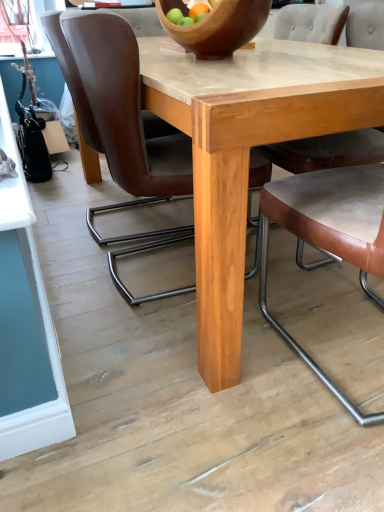
The width and height of the screenshot is (384, 512). What do you see at coordinates (248, 152) in the screenshot?
I see `natural wood table at center` at bounding box center [248, 152].

Where is `brown leather chair at center, acting as the 2th chair starting from the left`? Image resolution: width=384 pixels, height=512 pixels. brown leather chair at center, acting as the 2th chair starting from the left is located at coordinates (116, 98).

Looking at this image, how much space does brown leather chair at center, which ranks as the fourth chair in right-to-left order, occupy horizontally?

The width of brown leather chair at center, which ranks as the fourth chair in right-to-left order, is 24.62 inches.

I want to click on brown leather chair at center, arranged as the third chair when viewed from the left, so click(x=329, y=231).

Which object is positioned more to the right, brown leather chair at center, acting as the 2th chair starting from the left, or brown leather chair at center, which is counted as the second chair, starting from the right?

From the viewer's perspective, brown leather chair at center, which is counted as the second chair, starting from the right, appears more on the right side.

Is brown leather chair at center, which is counted as the second chair, starting from the right, at the back of brown leather chair at center, acting as the 2th chair starting from the left?

No, brown leather chair at center, acting as the 2th chair starting from the left,'s orientation is not away from brown leather chair at center, which is counted as the second chair, starting from the right.

Is the depth of brown leather chair at center, the third chair viewed from the right, greater than that of brown leather chair at center, which is counted as the second chair, starting from the right?

Yes, brown leather chair at center, the third chair viewed from the right, is further from the camera.

From the image's perspective, which is below, brown leather chair at center, the third chair viewed from the right, or brown leather chair at center, arranged as the third chair when viewed from the left?

brown leather chair at center, arranged as the third chair when viewed from the left.

From the image's perspective, which one is positioned lower, natural wood table at center or wooden bowl at center?

natural wood table at center, from the image's perspective.

The image size is (384, 512). Identify the location of round table below the wooden bowl at center (from a real-world perspective). (248, 152).

Does natural wood table at center have a lesser width compared to wooden bowl at center?

In fact, natural wood table at center might be wider than wooden bowl at center.

From the picture: From a real-world perspective, is natural wood table at center under wooden bowl at center?

Yes, from a real-world perspective, natural wood table at center is below wooden bowl at center.

In terms of height, does brown leather chair at center, marked as the 4th chair in a left-to-right arrangement, look taller or shorter compared to wooden bowl at center?

Clearly, brown leather chair at center, marked as the 4th chair in a left-to-right arrangement, is taller compared to wooden bowl at center.

Does brown leather chair at center, acting as the 1th chair starting from the right, turn towards wooden bowl at center?

Yes, brown leather chair at center, acting as the 1th chair starting from the right, faces towards wooden bowl at center.

Visually, is brown leather chair at center, acting as the 1th chair starting from the right, positioned to the left or to the right of brown leather chair at center, the 1th chair in the left-to-right sequence?

brown leather chair at center, acting as the 1th chair starting from the right, is positioned on brown leather chair at center, the 1th chair in the left-to-right sequence,'s right side.

Is brown leather chair at center, acting as the 1th chair starting from the right, directly adjacent to brown leather chair at center, the 1th chair in the left-to-right sequence?

There is a gap between brown leather chair at center, acting as the 1th chair starting from the right, and brown leather chair at center, the 1th chair in the left-to-right sequence.

Which of these two, brown leather chair at center, marked as the 4th chair in a left-to-right arrangement, or brown leather chair at center, the 1th chair in the left-to-right sequence, stands shorter?

With less height is brown leather chair at center, the 1th chair in the left-to-right sequence.

From the image's perspective, would you say brown leather chair at center, marked as the 4th chair in a left-to-right arrangement, is shown under brown leather chair at center, which ranks as the fourth chair in right-to-left order?

Correct, brown leather chair at center, marked as the 4th chair in a left-to-right arrangement, appears lower than brown leather chair at center, which ranks as the fourth chair in right-to-left order, in the image.

From the image's perspective, which one is positioned lower, brown leather chair at center, the 1th chair in the left-to-right sequence, or wooden bowl at center?

brown leather chair at center, the 1th chair in the left-to-right sequence, appears lower in the image.

Looking at this image, is brown leather chair at center, the 1th chair in the left-to-right sequence, looking in the opposite direction of wooden bowl at center?

No.

Consider the image. Does brown leather chair at center, which ranks as the fourth chair in right-to-left order, lie in front of wooden bowl at center?

No, brown leather chair at center, which ranks as the fourth chair in right-to-left order, is further to the viewer.

Does brown leather chair at center, the 1th chair in the left-to-right sequence, appear on the right side of wooden bowl at center?

In fact, brown leather chair at center, the 1th chair in the left-to-right sequence, is to the left of wooden bowl at center.

From the picture: Could you measure the distance between natural wood table at center and brown leather chair at center, acting as the 1th chair starting from the right?

natural wood table at center is 86.34 centimeters away from brown leather chair at center, acting as the 1th chair starting from the right.

Looking at the image, does natural wood table at center seem bigger or smaller compared to brown leather chair at center, acting as the 1th chair starting from the right?

In the image, natural wood table at center appears to be larger than brown leather chair at center, acting as the 1th chair starting from the right.

Is natural wood table at center in front of brown leather chair at center, marked as the 4th chair in a left-to-right arrangement?

Yes, natural wood table at center is closer to the viewer.

The height and width of the screenshot is (512, 384). In order to click on the 4th chair located above the natural wood table at center (from a real-world perspective) in this screenshot , I will do `click(332, 25)`.

Who is more distant, brown leather chair at center, which ranks as the fourth chair in right-to-left order, or brown leather chair at center, acting as the 2th chair starting from the left?

brown leather chair at center, which ranks as the fourth chair in right-to-left order.

Is brown leather chair at center, the 1th chair in the left-to-right sequence, completely or partially outside of brown leather chair at center, acting as the 2th chair starting from the left?

Absolutely, brown leather chair at center, the 1th chair in the left-to-right sequence, is external to brown leather chair at center, acting as the 2th chair starting from the left.

From a real-world perspective, is brown leather chair at center, the 1th chair in the left-to-right sequence, under brown leather chair at center, acting as the 2th chair starting from the left?

No.

Is point (68, 57) positioned after point (125, 295)?

No, (68, 57) is closer to viewer.

The width and height of the screenshot is (384, 512). In the image, there is a brown leather chair at center, the third chair viewed from the right. What are the coordinates of `chair below it (from a real-world perspective)` in the screenshot? It's located at (329, 231).

Where is `bowl behind the natural wood table at center`? This screenshot has width=384, height=512. bowl behind the natural wood table at center is located at coordinates (217, 26).

Considering their positions, is brown leather chair at center, which ranks as the fourth chair in right-to-left order, positioned closer to brown leather chair at center, the third chair viewed from the right, than brown leather chair at center, which is counted as the second chair, starting from the right?

Based on the image, brown leather chair at center, which ranks as the fourth chair in right-to-left order, appears to be nearer to brown leather chair at center, the third chair viewed from the right.

From the image, which object appears to be nearer to wooden bowl at center, brown leather chair at center, acting as the 2th chair starting from the left, or brown leather chair at center, marked as the 4th chair in a left-to-right arrangement?

brown leather chair at center, acting as the 2th chair starting from the left, is positioned closer to the anchor wooden bowl at center.

Estimate the real-world distances between objects in this image. Which object is closer to brown leather chair at center, the third chair viewed from the right, brown leather chair at center, the 1th chair in the left-to-right sequence, or wooden bowl at center?

The object closer to brown leather chair at center, the third chair viewed from the right, is wooden bowl at center.

Which object lies further to the anchor point brown leather chair at center, the third chair viewed from the right, wooden bowl at center or brown leather chair at center, marked as the 4th chair in a left-to-right arrangement?

Based on the image, brown leather chair at center, marked as the 4th chair in a left-to-right arrangement, appears to be further to brown leather chair at center, the third chair viewed from the right.

Which object lies nearer to the anchor point brown leather chair at center, the 1th chair in the left-to-right sequence, brown leather chair at center, marked as the 4th chair in a left-to-right arrangement, or natural wood table at center?

natural wood table at center is positioned closer to the anchor brown leather chair at center, the 1th chair in the left-to-right sequence.

In the scene shown: Looking at the image, which one is located further to brown leather chair at center, arranged as the third chair when viewed from the left, wooden bowl at center or brown leather chair at center, which ranks as the fourth chair in right-to-left order?

Among the two, brown leather chair at center, which ranks as the fourth chair in right-to-left order, is located further to brown leather chair at center, arranged as the third chair when viewed from the left.

Looking at the image, which one is located closer to natural wood table at center, wooden bowl at center or brown leather chair at center, which is counted as the second chair, starting from the right?

brown leather chair at center, which is counted as the second chair, starting from the right, lies closer to natural wood table at center than the other object.

Estimate the real-world distances between objects in this image. Which object is closer to brown leather chair at center, which is counted as the second chair, starting from the right, brown leather chair at center, which ranks as the fourth chair in right-to-left order, or natural wood table at center?

Result: Among the two, natural wood table at center is located nearer to brown leather chair at center, which is counted as the second chair, starting from the right.

Find the location of a particular element. The width and height of the screenshot is (384, 512). bowl situated between brown leather chair at center, the third chair viewed from the right, and brown leather chair at center, acting as the 1th chair starting from the right, from left to right is located at coordinates (217, 26).

Locate an element on the screen. The width and height of the screenshot is (384, 512). chair situated between brown leather chair at center, the third chair viewed from the right, and brown leather chair at center, marked as the 4th chair in a left-to-right arrangement, from left to right is located at coordinates (329, 231).

Locate an element on the screen. The image size is (384, 512). round table situated between brown leather chair at center, which ranks as the fourth chair in right-to-left order, and brown leather chair at center, marked as the 4th chair in a left-to-right arrangement, from left to right is located at coordinates (248, 152).

The height and width of the screenshot is (512, 384). I want to click on bowl between brown leather chair at center, acting as the 2th chair starting from the left, and brown leather chair at center, the 1th chair in the left-to-right sequence, from front to back, so click(217, 26).